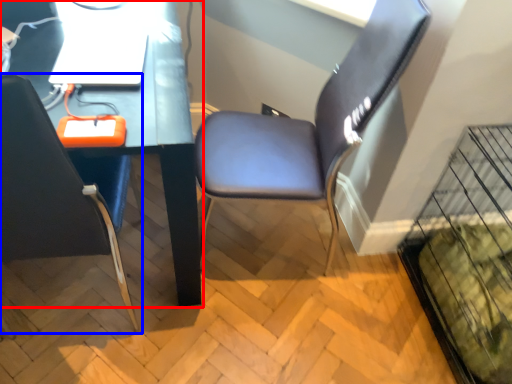
Question: Which point is closer to the camera, computer desk (highlighted by a red box) or chair (highlighted by a blue box)?

Choices:
 (A) computer desk
 (B) chair

Answer: (B)